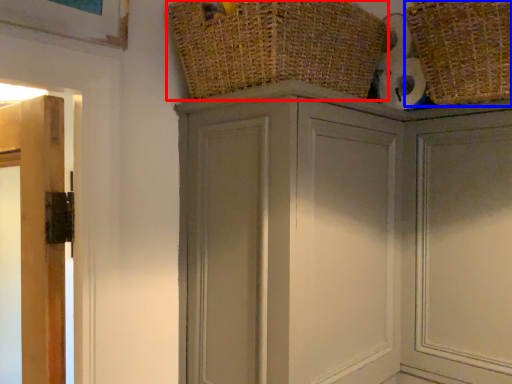
Question: Among these objects, which one is farthest to the camera, basket (highlighted by a red box) or basket (highlighted by a blue box)?

Choices:
 (A) basket
 (B) basket

Answer: (B)